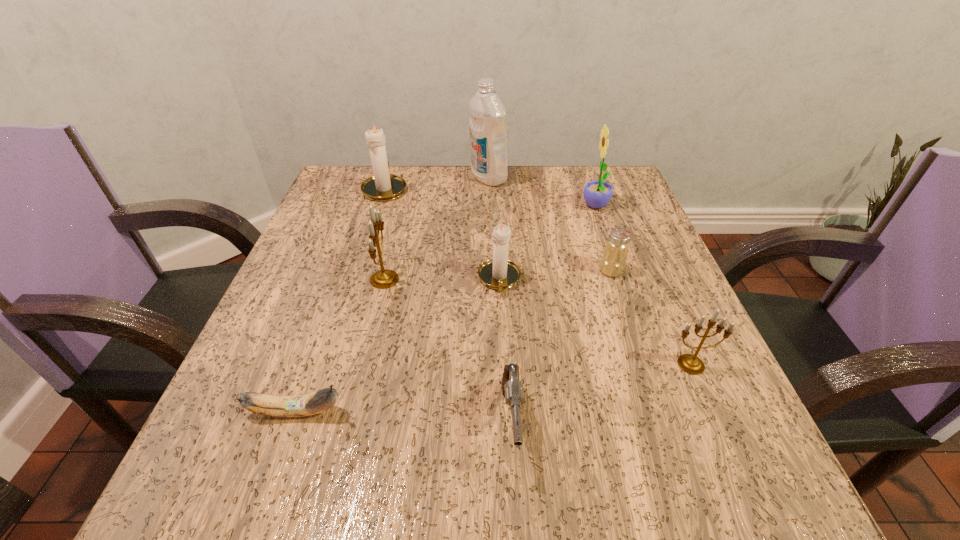
You are a GUI agent. You are given a task and a screenshot of the screen. Output one action in this format:
    pyautogui.click(x=<x>, y=<y>)
    Task: Click on the free spot located on the back of the nearest candelabrum
    
    Given the screenshot: What is the action you would take?
    pyautogui.click(x=629, y=221)

At what (x,y) coordinates should I click in order to perform the action: click on blank space located 0.190m on the back of the saltshaker. Please return your answer as a coordinate pair (x, y). Looking at the image, I should click on (590, 210).

At what (x,y) coordinates should I click in order to perform the action: click on free location located at the stem of the shortest object. Please return your answer as a coordinate pair (x, y). Looking at the image, I should click on (515, 411).

The height and width of the screenshot is (540, 960). I want to click on detergent present at the far edge, so click(x=487, y=117).

This screenshot has height=540, width=960. In order to click on sunflower that is at the far edge in this screenshot , I will do coord(597,193).

The height and width of the screenshot is (540, 960). What are the coordinates of `candle holder that is at the far edge` in the screenshot? It's located at (383, 186).

Image resolution: width=960 pixels, height=540 pixels. I want to click on object that is positioned at the near edge, so click(512, 389).

The height and width of the screenshot is (540, 960). In order to click on banana located at the left edge in this screenshot , I will do `click(319, 401)`.

The height and width of the screenshot is (540, 960). What are the coordinates of `sunflower located at the right edge` in the screenshot? It's located at (597, 193).

This screenshot has width=960, height=540. Identify the location of candelabrum that is at the right edge. (689, 363).